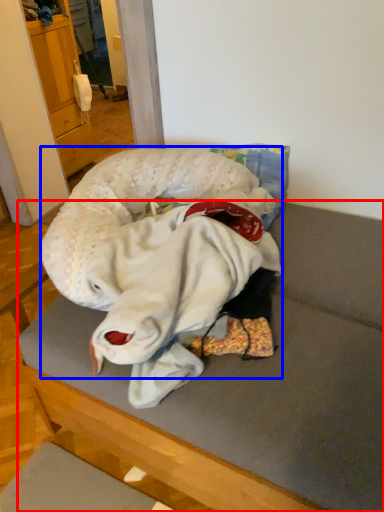
Question: Which of the following is the farthest to the observer, furniture (highlighted by a red box) or baby (highlighted by a blue box)?

Choices:
 (A) furniture
 (B) baby

Answer: (B)